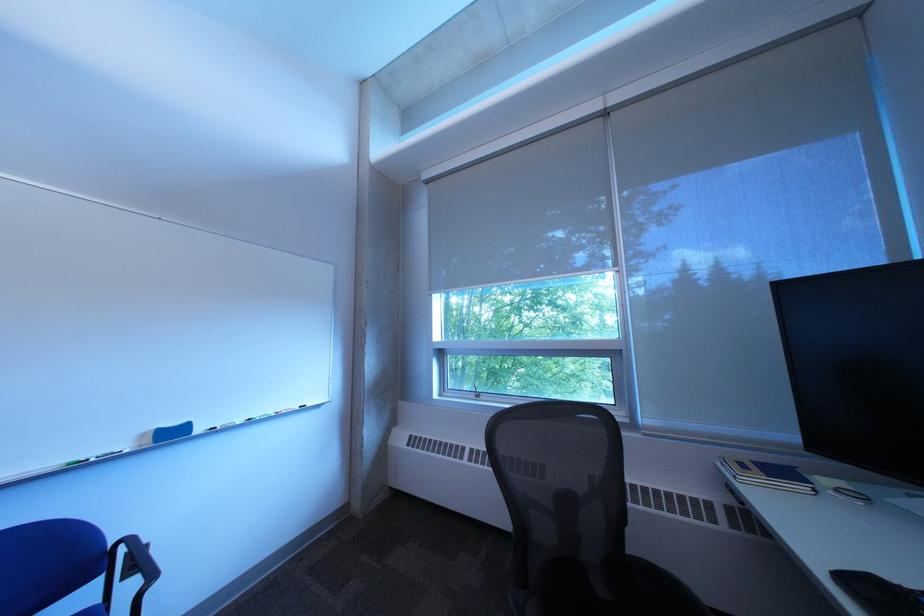
Locate an element on the screen. black chair armrest is located at coordinates (554, 588).